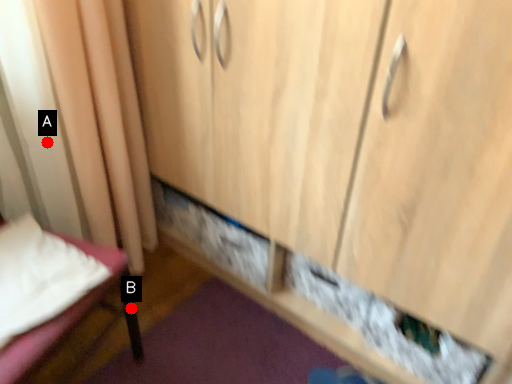
Question: Two points are circled on the image, labeled by A and B beside each circle. Which of the following is the closest to the observer?

Choices:
 (A) A is closer
 (B) B is closer

Answer: (A)